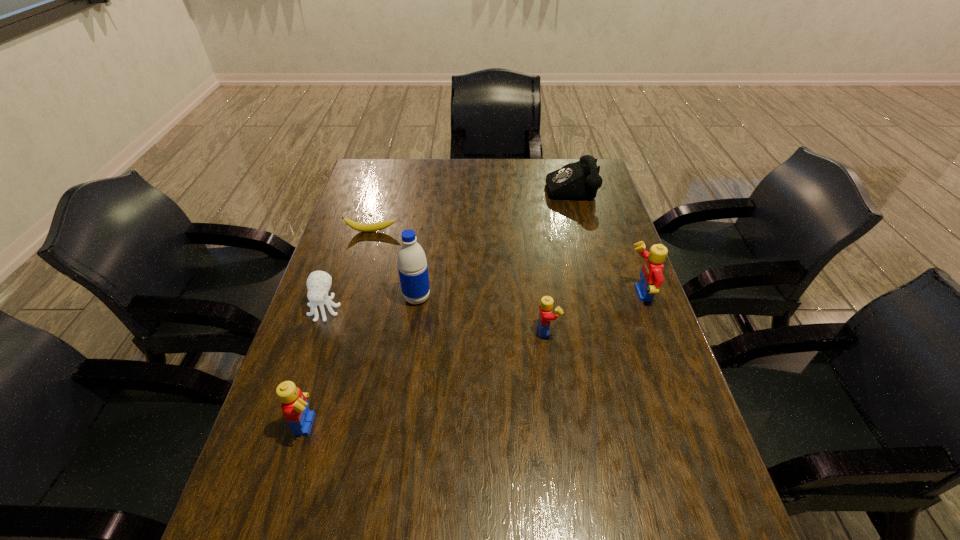
At what (x,y) coordinates should I click in order to perform the action: click on free spot between the tallest object and the rightmost Lego. Please return your answer as a coordinate pair (x, y). Looking at the image, I should click on (528, 296).

This screenshot has height=540, width=960. What are the coordinates of `free spot between the fifth object from left to right and the fourth object from left to right` in the screenshot? It's located at (482, 314).

The width and height of the screenshot is (960, 540). I want to click on vacant area between the second Lego from left to right and the rightmost Lego, so click(592, 313).

The image size is (960, 540). Identify the location of unoccupied position between the octopus and the tallest object. (371, 303).

The height and width of the screenshot is (540, 960). I want to click on vacant point located between the fourth object from right to left and the farthest object, so click(493, 241).

Locate an element on the screen. This screenshot has height=540, width=960. object that ranks as the closest to the leftmost Lego is located at coordinates [318, 283].

Select which object appears as the fifth closest to the shortest object. Please provide its 2D coordinates. Your answer should be formatted as a tuple, i.e. [(x, y)], where the tuple contains the x and y coordinates of a point satisfying the conditions above.

[(294, 405)]

Locate which Lego ranks in proximity to the rightmost Lego. Please provide its 2D coordinates. Your answer should be formatted as a tuple, i.e. [(x, y)], where the tuple contains the x and y coordinates of a point satisfying the conditions above.

[(545, 317)]

Point out which Lego is positioned as the second nearest to the banana. Please provide its 2D coordinates. Your answer should be formatted as a tuple, i.e. [(x, y)], where the tuple contains the x and y coordinates of a point satisfying the conditions above.

[(294, 405)]

Identify the location of free space in the image that satisfies the following two spatial constraints: 1. on the dial of the farthest object; 2. on the front-facing side of the octopus. Image resolution: width=960 pixels, height=540 pixels. (602, 309).